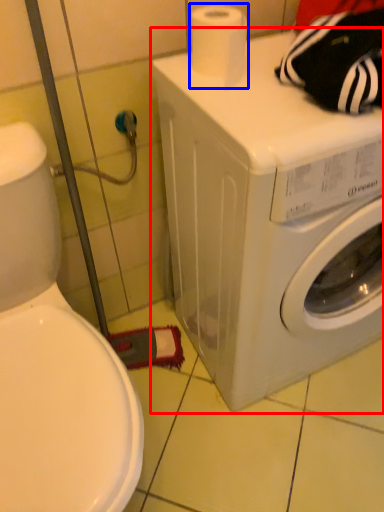
Question: Among these objects, which one is nearest to the camera, washing machine (highlighted by a red box) or toilet paper (highlighted by a blue box)?

Choices:
 (A) washing machine
 (B) toilet paper

Answer: (A)